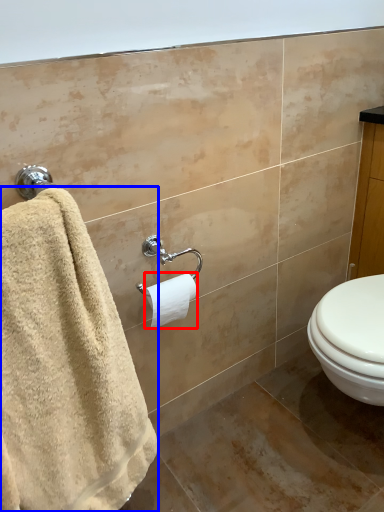
Question: Which of the following is the closest to the observer, toilet paper (highlighted by a red box) or towel (highlighted by a blue box)?

Choices:
 (A) toilet paper
 (B) towel

Answer: (B)